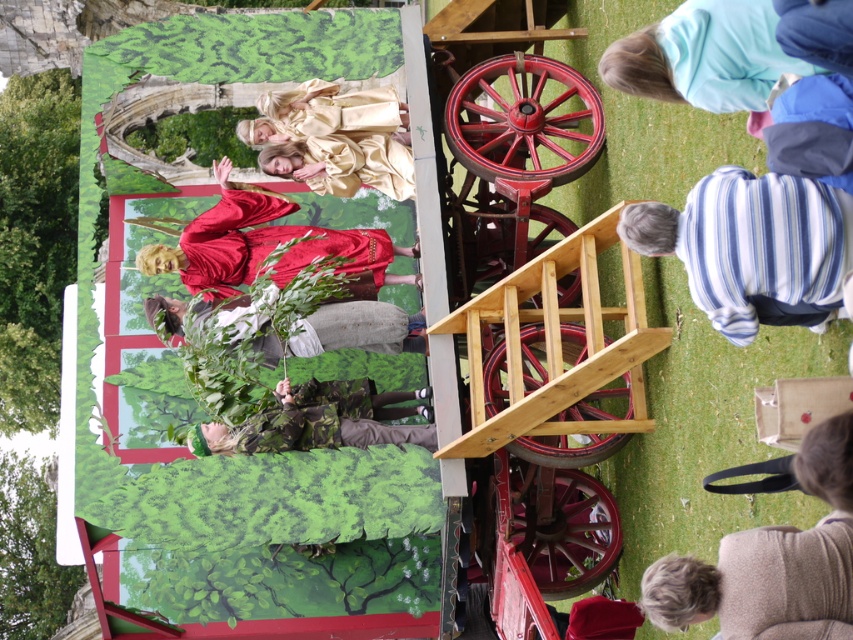
Which is in front, point (691, 221) or point (280, 268)?

Point (691, 221)

Can you confirm if striped cotton shirt at lower right is positioned to the left of matte red robe at center?

Incorrect, striped cotton shirt at lower right is not on the left side of matte red robe at center.

Who is more distant from viewer, (840, 218) or (346, 237)?

Point (346, 237)

The width and height of the screenshot is (853, 640). In order to click on striped cotton shirt at lower right in this screenshot , I will do `click(752, 248)`.

Does camouflage fabric at center lie behind camouflage fabric pants at center?

No.

Can you confirm if camouflage fabric at center is wider than camouflage fabric pants at center?

Incorrect, camouflage fabric at center's width does not surpass camouflage fabric pants at center's.

The height and width of the screenshot is (640, 853). Describe the element at coordinates (318, 420) in the screenshot. I see `camouflage fabric at center` at that location.

Locate an element on the screen. The width and height of the screenshot is (853, 640). camouflage fabric at center is located at coordinates (318, 420).

Between striped cotton shirt at lower right and camouflage fabric pants at center, which one appears on the right side from the viewer's perspective?

striped cotton shirt at lower right

Is striped cotton shirt at lower right closer to camera compared to camouflage fabric pants at center?

Yes, striped cotton shirt at lower right is in front of camouflage fabric pants at center.

At what (x,y) coordinates should I click in order to perform the action: click on striped cotton shirt at lower right. Please return your answer as a coordinate pair (x, y). This screenshot has width=853, height=640. Looking at the image, I should click on (752, 248).